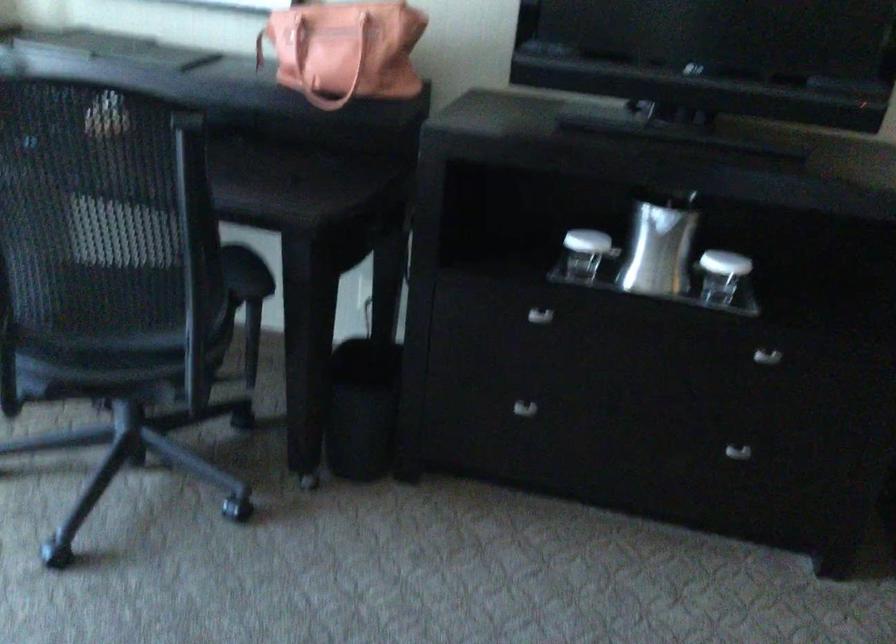
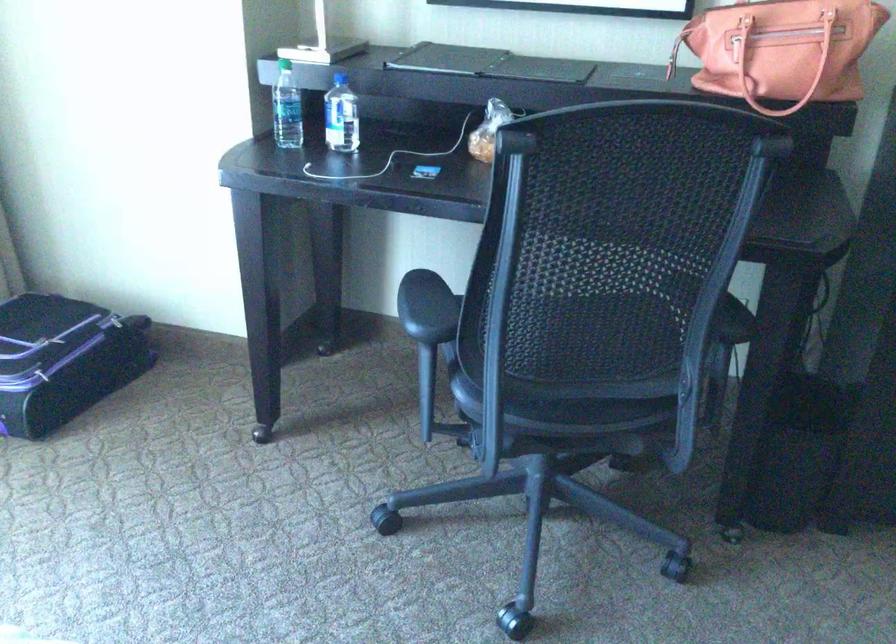
Question: The images are taken continuously from a first-person perspective. In which direction is your viewpoint rotating?

Choices:
 (A) Left
 (B) Right
 (C) Up
 (D) Down

Answer: (A)